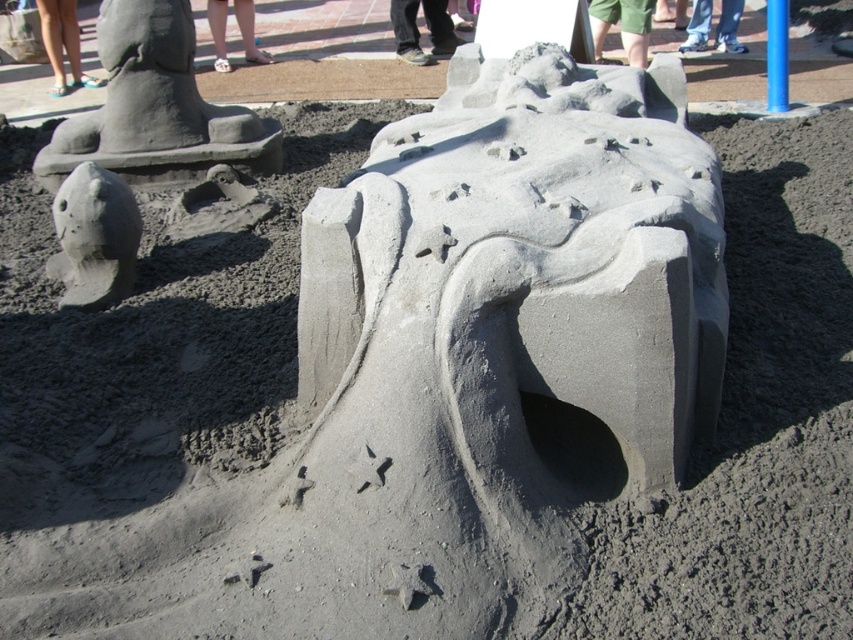
Question: Which point appears farthest from the camera in this image?

Choices:
 (A) (631, 61)
 (B) (415, 38)
 (C) (80, 163)

Answer: (B)

Question: Is brown leather shoes at center behind white leather shoes at upper center?

Choices:
 (A) yes
 (B) no

Answer: (B)

Question: Which of the following is the closest to the observer?

Choices:
 (A) blue flip-flops at lower left
 (B) white leather shoes at upper center
 (C) gray sand sculpture at left
 (D) tan skin foot at lower center

Answer: (C)

Question: Is gray sand sculpture at left thinner than brown leather shoes at center?

Choices:
 (A) yes
 (B) no

Answer: (A)

Question: Which of the following is the closest to the observer?

Choices:
 (A) gray sand sculpture at left
 (B) brown leather shoes at center

Answer: (A)

Question: Does white leather shoes at upper center have a lesser width compared to tan skin foot at lower center?

Choices:
 (A) yes
 (B) no

Answer: (B)